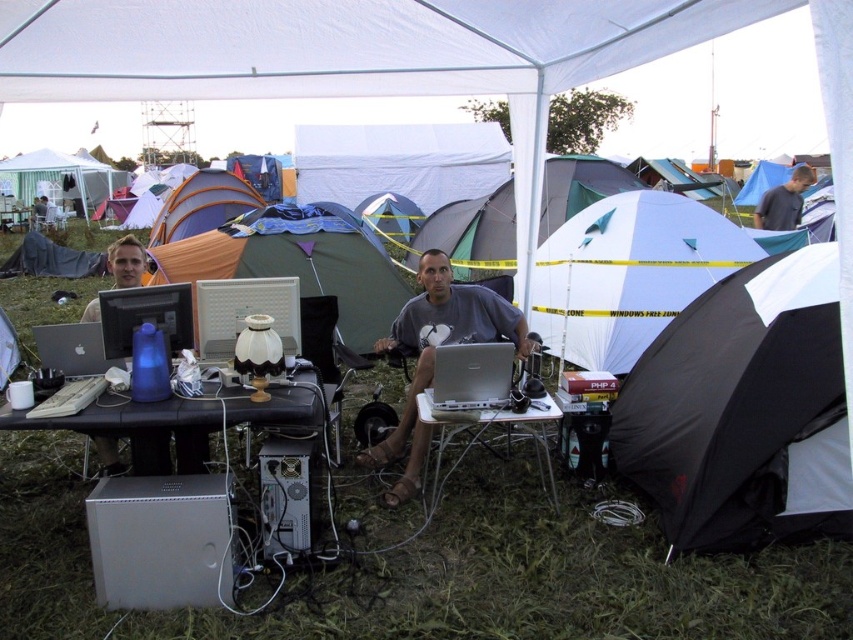
You are standing at the entrance of the tent and want to place a new folding chair at the white plastic table at center. According to the coordinates provided, where exactly should you position the chair relative to the table?

The white plastic table at center is located at point coordinates (486,428), so you should position the chair at those coordinates to place it correctly at the table.

You are a participant at an outdoor event and need to decide whether to place your laptop on the white plastic table at center or the gray fabric shirt at center. Which surface is more suitable based on their heights?

The white plastic table at center is shorter than the gray fabric shirt at center. Therefore, placing the laptop on the white plastic table at center would be more suitable as it provides a stable, flat surface at a lower height compared to the gray fabric shirt at center.